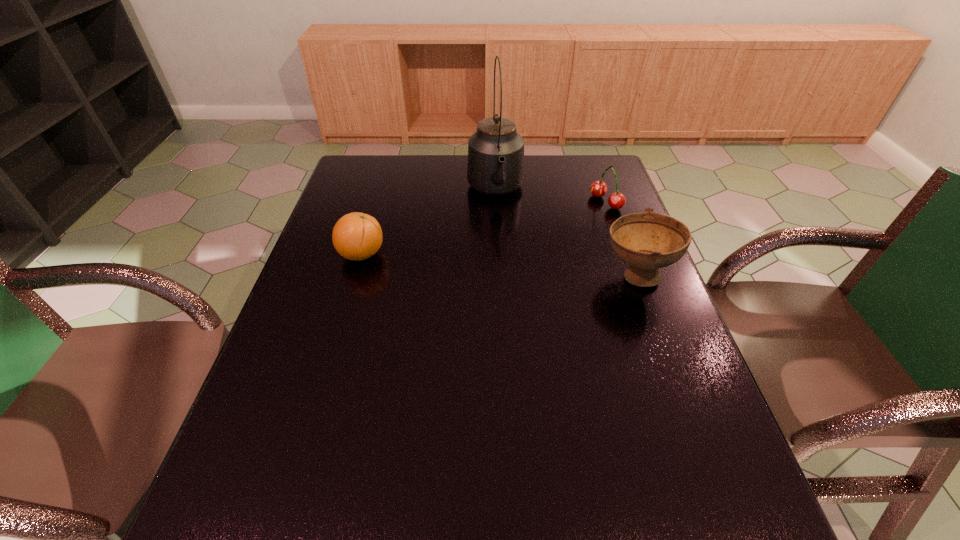
Locate an element on the screen. Image resolution: width=960 pixels, height=540 pixels. vacant area situated 0.050m spout on the kettle is located at coordinates (500, 225).

Identify the location of blank area located spout on the kettle. (501, 228).

At what (x,y) coordinates should I click in order to perform the action: click on free location located 0.110m spout on the kettle. Please return your answer as a coordinate pair (x, y). Looking at the image, I should click on (503, 237).

You are a GUI agent. You are given a task and a screenshot of the screen. Output one action in this format:
    pyautogui.click(x=<x>, y=<y>)
    Task: Click on the cherry positioned at the far edge
    The image size is (960, 540).
    Given the screenshot: What is the action you would take?
    click(x=617, y=200)

This screenshot has height=540, width=960. I want to click on kettle located at the far edge, so click(x=495, y=166).

Where is `object present at the left edge`? object present at the left edge is located at coordinates (356, 236).

Locate an element on the screen. soup bowl present at the right edge is located at coordinates (647, 241).

Where is `cherry located at the right edge`? The height and width of the screenshot is (540, 960). cherry located at the right edge is located at coordinates (617, 200).

Where is `object that is positioned at the far right corner`? This screenshot has height=540, width=960. object that is positioned at the far right corner is located at coordinates (617, 200).

At what (x,y) coordinates should I click in order to perform the action: click on free space at the far edge. Please return your answer as a coordinate pair (x, y). The width and height of the screenshot is (960, 540). Looking at the image, I should click on (560, 165).